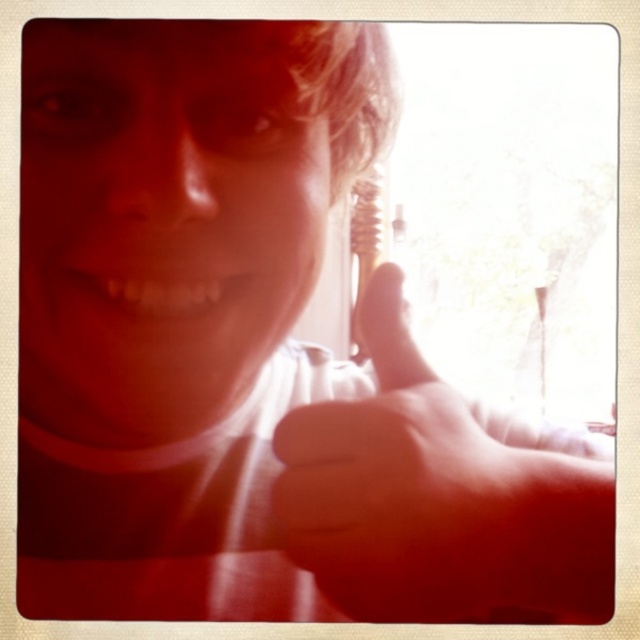
Based on the photo, you are a photographer adjusting the lighting for a closeup portrait. You notice the subject has a smooth skin hand at center and matte white teeth at center. Which object should you focus on first to ensure proper exposure, the one closer to the camera or the one further away?

The smooth skin hand at center is in front of matte white teeth at center, so you should focus on the smooth skin hand at center first since it is closer to the camera.

You are a photographer trying to adjust the focus of your camera. You want to ensure both the smooth skin hand at center and the matte white teeth at center are in focus. Given that the depth of field can cover 10 inches, will both objects be in focus?

The smooth skin hand at center and the matte white teeth at center are 10.21 inches apart. Since the depth of field can cover 10 inches, the distance between them exceeds the coverage, so both objects may not be fully in focus.